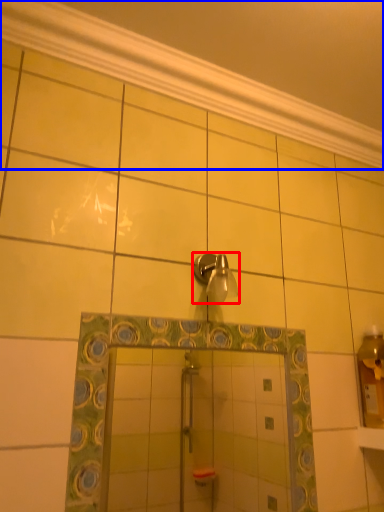
Question: Among these objects, which one is nearest to the camera, shower (highlighted by a red box) or molding (highlighted by a blue box)?

Choices:
 (A) shower
 (B) molding

Answer: (B)